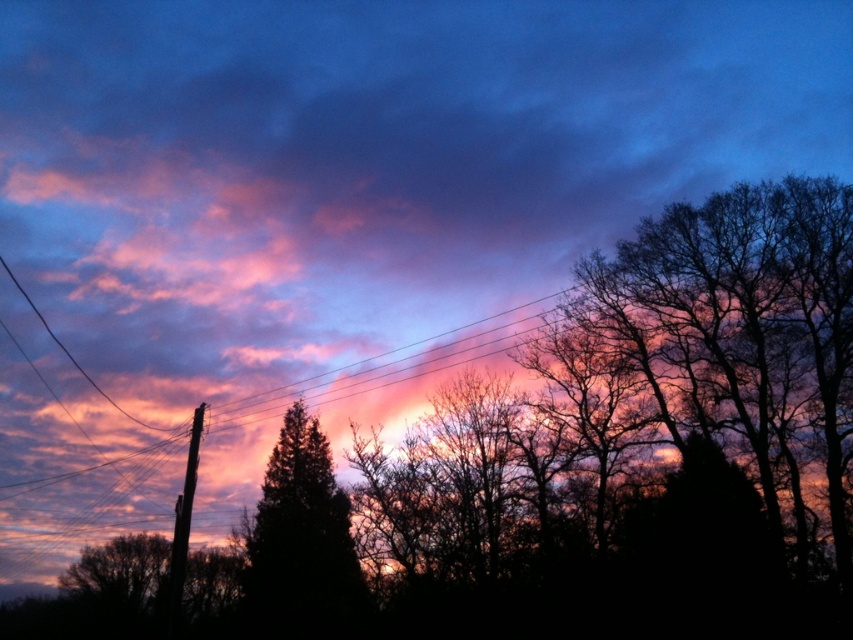
You are an artist planning to paint this sunset scene. You want to ensure the green matte tree at center and the brown wooden telegraph pole at left are proportionally accurate. Which object should you paint smaller to maintain the correct size relationship?

The green matte tree at center should be painted smaller than the brown wooden telegraph pole at left to maintain the correct size relationship.

You are a photographer trying to capture the sunset. You notice the green matte tree at center and the brown wooden telegraph pole at left in your frame. Which object will appear closer to the camera in your photo?

The green matte tree at center will appear closer to the camera because the brown wooden telegraph pole at left is behind it.